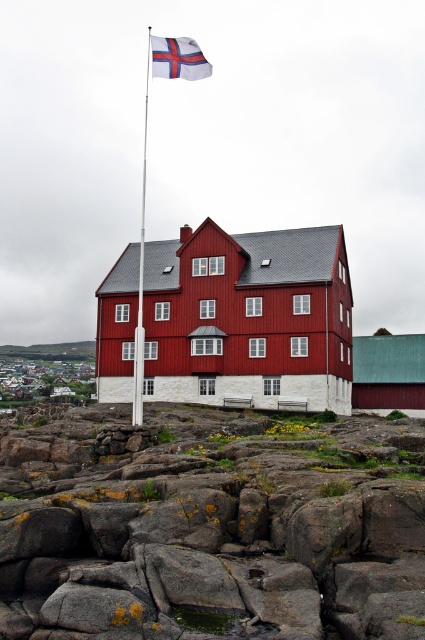
Between rusty rock at center and white fabric flag at upper center, which one appears on the right side from the viewer's perspective?

From the viewer's perspective, rusty rock at center appears more on the right side.

Between rusty rock at center and white fabric flag at upper center, which one is positioned higher?

white fabric flag at upper center

Who is more forward, (x=240, y=580) or (x=195, y=64)?

Point (x=240, y=580) is in front.

Where is `rusty rock at center`? The height and width of the screenshot is (640, 425). rusty rock at center is located at coordinates (210, 525).

Find the location of `rusty rock at center`. rusty rock at center is located at coordinates (210, 525).

Is rusty rock at center smaller than matte red building at center?

Yes, rusty rock at center is smaller than matte red building at center.

Which is behind, point (161, 486) or point (147, 250)?

The point (147, 250) is more distant.

The height and width of the screenshot is (640, 425). I want to click on rusty rock at center, so click(x=210, y=525).

Is point (136, 392) positioned after point (189, 60)?

No, (136, 392) is in front of (189, 60).

Identify the location of white plastic flag pole at upper center. This screenshot has width=425, height=640. (141, 276).

Is point (133, 410) less distant than point (167, 60)?

Yes, it is in front of point (167, 60).

Identify the location of white plastic flag pole at upper center. The width and height of the screenshot is (425, 640). (141, 276).